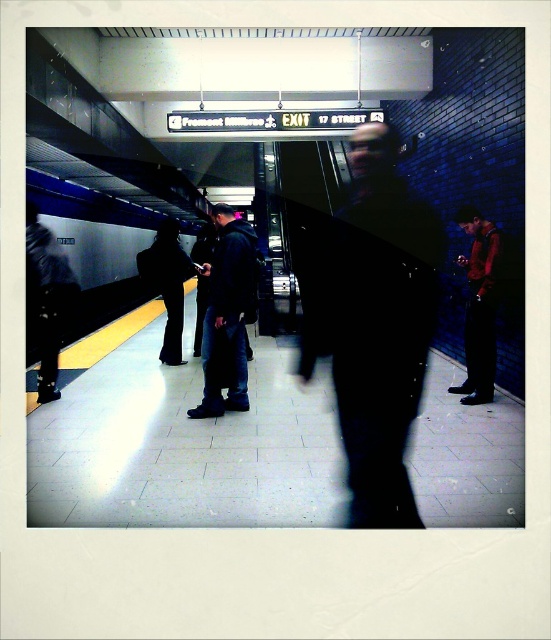
Question: Which of these objects is positioned farthest from the black fabric pants at center?

Choices:
 (A) metallic silver platform at center
 (B) dark fabric jacket at center
 (C) dark blue jeans at center
 (D) dark gray pants at left

Answer: (B)

Question: Can you confirm if dark fabric jacket at center is smaller than metallic silver train at left?

Choices:
 (A) no
 (B) yes

Answer: (B)

Question: Considering the real-world distances, which object is farthest from the metallic silver train at left?

Choices:
 (A) metallic silver platform at center
 (B) black fabric pants at center

Answer: (B)

Question: Does red shirt at right have a greater width compared to dark gray pants at left?

Choices:
 (A) no
 (B) yes

Answer: (A)

Question: Considering the real-world distances, which object is farthest from the metallic silver train at left?

Choices:
 (A) dark fabric jacket at center
 (B) red shirt at right
 (C) metallic silver platform at center

Answer: (A)

Question: Does red shirt at right lie in front of black fabric pants at center?

Choices:
 (A) no
 (B) yes

Answer: (B)